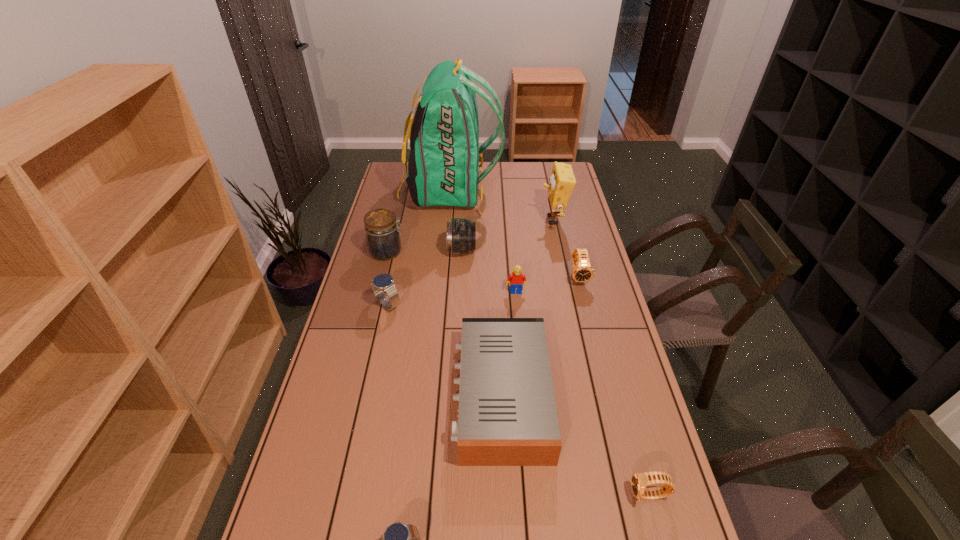
The height and width of the screenshot is (540, 960). What are the coordinates of `backpack` in the screenshot? It's located at (443, 167).

You are a GUI agent. You are given a task and a screenshot of the screen. Output one action in this format:
    pyautogui.click(x=<x>, y=<y>)
    Task: Click on the ninth shortest object
    The height and width of the screenshot is (540, 960).
    Given the screenshot: What is the action you would take?
    pyautogui.click(x=562, y=181)

The width and height of the screenshot is (960, 540). I want to click on the eighth shortest object, so click(x=382, y=231).

Where is `telephoto lens`? The height and width of the screenshot is (540, 960). telephoto lens is located at coordinates (460, 233).

The height and width of the screenshot is (540, 960). In order to click on the farthest watch in this screenshot , I will do `click(582, 271)`.

Locate an element on the screen. Image resolution: width=960 pixels, height=540 pixels. the fifth farthest object is located at coordinates (582, 271).

Identify the location of red Lego. The height and width of the screenshot is (540, 960). (517, 279).

Find the location of a particular element. The width and height of the screenshot is (960, 540). the farther blue watch is located at coordinates (384, 282).

Identify the location of the leftmost watch. (384, 282).

Identify the location of radio receiver. (507, 416).